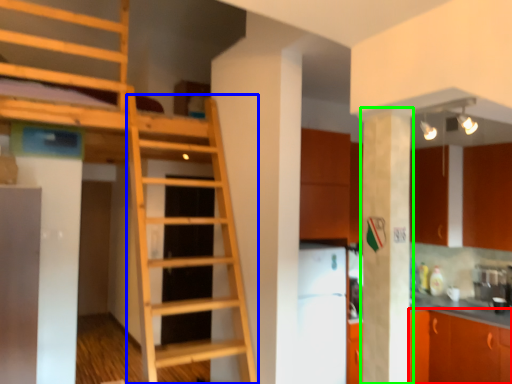
Question: Estimate the real-world distances between objects in this image. Which object is farther from cabinetry (highlighted by a red box), ladder (highlighted by a blue box) or pillar (highlighted by a green box)?

Choices:
 (A) ladder
 (B) pillar

Answer: (A)